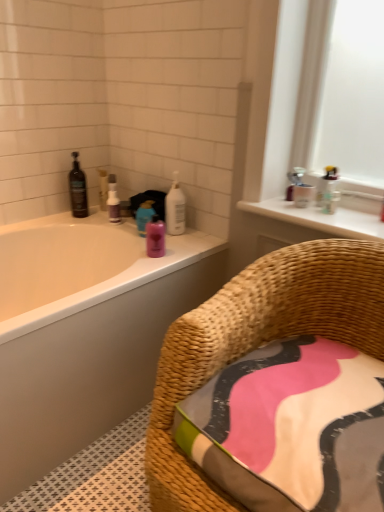
Question: Considering the relative sizes of woven rattan chair at lower right and black glass bottle at upper left in the image provided, is woven rattan chair at lower right shorter than black glass bottle at upper left?

Choices:
 (A) no
 (B) yes

Answer: (A)

Question: Is woven rattan chair at lower right turned away from black glass bottle at upper left?

Choices:
 (A) no
 (B) yes

Answer: (A)

Question: Is woven rattan chair at lower right facing towards black glass bottle at upper left?

Choices:
 (A) no
 (B) yes

Answer: (A)

Question: From the image's perspective, is woven rattan chair at lower right beneath black glass bottle at upper left?

Choices:
 (A) no
 (B) yes

Answer: (B)

Question: Considering the relative positions of woven rattan chair at lower right and black glass bottle at upper left in the image provided, is woven rattan chair at lower right to the right of black glass bottle at upper left from the viewer's perspective?

Choices:
 (A) yes
 (B) no

Answer: (A)

Question: From a real-world perspective, is white glossy bottle at upper center, the 1th cleaning product when ordered from right to left, physically located above or below white glossy window sill at upper right?

Choices:
 (A) above
 (B) below

Answer: (B)

Question: In the image, is white glossy bottle at upper center, the 1th cleaning product when ordered from right to left, on the left side or the right side of white glossy window sill at upper right?

Choices:
 (A) right
 (B) left

Answer: (B)

Question: Is white glossy bottle at upper center, arranged as the 2th cleaning product when viewed from the left, situated inside white glossy window sill at upper right or outside?

Choices:
 (A) inside
 (B) outside

Answer: (B)

Question: In the image, is white glossy bottle at upper center, the 1th cleaning product when ordered from right to left, positioned in front of or behind white glossy window sill at upper right?

Choices:
 (A) front
 (B) behind

Answer: (B)

Question: Do you think white glossy bathtub at upper left is within white glossy window sill at upper right, or outside of it?

Choices:
 (A) inside
 (B) outside

Answer: (B)

Question: From their relative heights in the image, would you say white glossy bathtub at upper left is taller or shorter than white glossy window sill at upper right?

Choices:
 (A) tall
 (B) short

Answer: (A)

Question: From a real-world perspective, is white glossy bathtub at upper left positioned above or below white glossy window sill at upper right?

Choices:
 (A) above
 (B) below

Answer: (B)

Question: In terms of size, does white glossy bathtub at upper left appear bigger or smaller than white glossy window sill at upper right?

Choices:
 (A) small
 (B) big

Answer: (B)

Question: Considering their positions, is woven rattan chair at lower right located in front of or behind translucent plastic bottles at upper right, the 1th toiletry when ordered from top to bottom?

Choices:
 (A) behind
 (B) front

Answer: (B)

Question: From the image's perspective, relative to translucent plastic bottles at upper right, acting as the second toiletry starting from the bottom, is woven rattan chair at lower right above or below?

Choices:
 (A) above
 (B) below

Answer: (B)